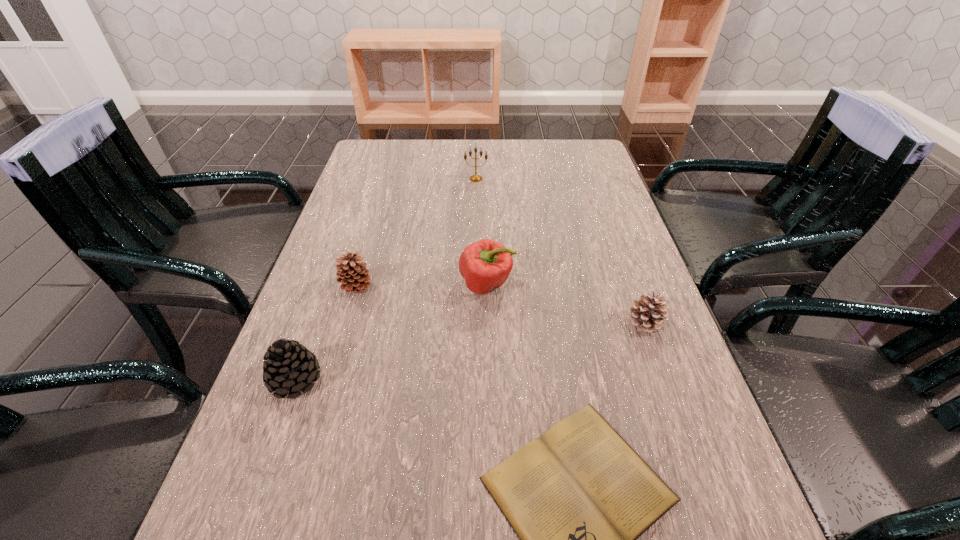
I want to click on free spot between the farthest pinecone and the fifth farthest object, so click(326, 333).

I want to click on vacant area that lies between the farthest pinecone and the nearest pinecone, so click(x=326, y=333).

You are a GUI agent. You are given a task and a screenshot of the screen. Output one action in this format:
    pyautogui.click(x=<x>, y=<y>)
    Task: Click on the free space between the rightmost pinecone and the candelabrum
    
    Given the screenshot: What is the action you would take?
    pyautogui.click(x=561, y=251)

Find the location of a particular element. free space that is in between the candelabrum and the farthest pinecone is located at coordinates (417, 233).

I want to click on free space between the farthest pinecone and the third nearest object, so click(501, 305).

Locate an element on the screen. The width and height of the screenshot is (960, 540). object that is the third closest to the farthest pinecone is located at coordinates (578, 497).

Locate an element on the screen. object that stands as the third closest to the farthest object is located at coordinates (647, 313).

Locate which pinecone ranks in proximity to the nearest object. Please provide its 2D coordinates. Your answer should be formatted as a tuple, i.e. [(x, y)], where the tuple contains the x and y coordinates of a point satisfying the conditions above.

[(647, 313)]

At what (x,y) coordinates should I click in order to perform the action: click on pinecone that is the third nearest to the nearest object. Please return your answer as a coordinate pair (x, y). This screenshot has height=540, width=960. Looking at the image, I should click on (351, 271).

Where is `free location that satisfies the following two spatial constraints: 1. on the front side of the farthest pinecone; 2. on the right side of the second farthest pinecone`? The image size is (960, 540). free location that satisfies the following two spatial constraints: 1. on the front side of the farthest pinecone; 2. on the right side of the second farthest pinecone is located at coordinates [x=347, y=322].